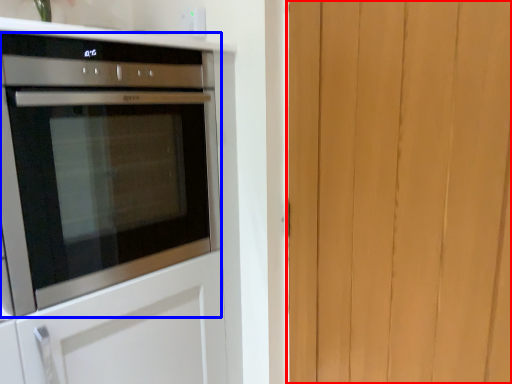
Question: Which object is closer to the camera taking this photo, barn door (highlighted by a red box) or oven (highlighted by a blue box)?

Choices:
 (A) barn door
 (B) oven

Answer: (A)